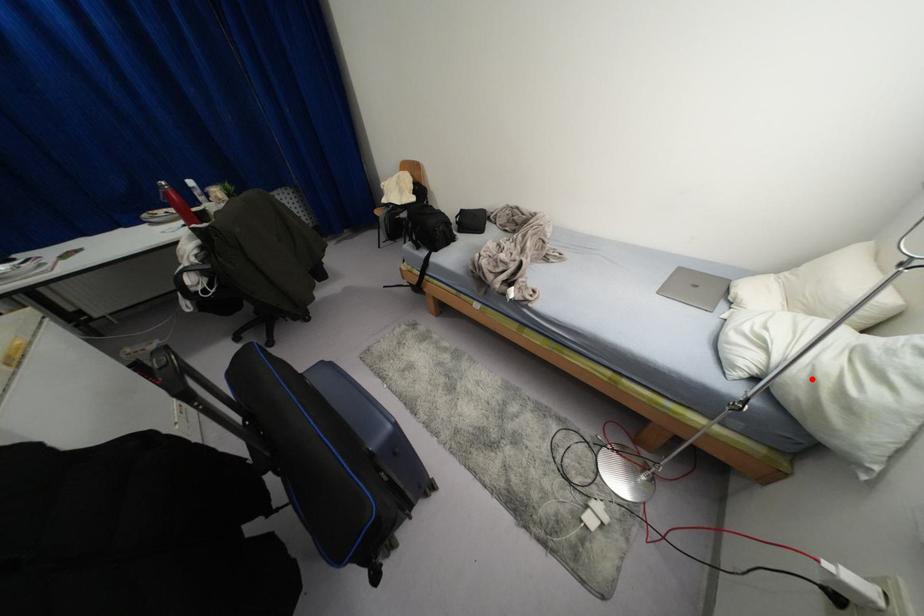
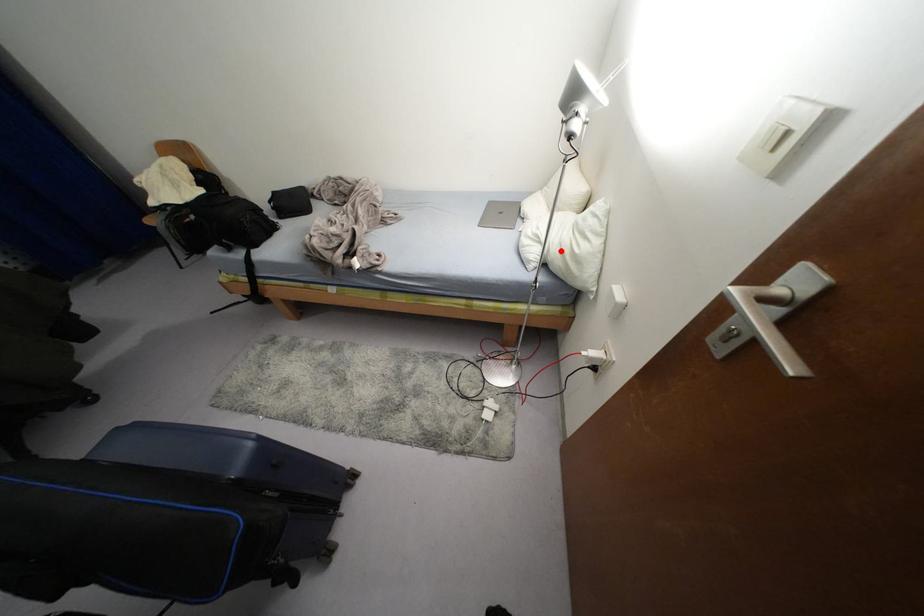
I am providing you with two images of the same scene from different viewpoints. A red point is marked on the first image and another point is marked on the second image. Are the points marked in image1 and image2 representing the same 3D position?

Yes